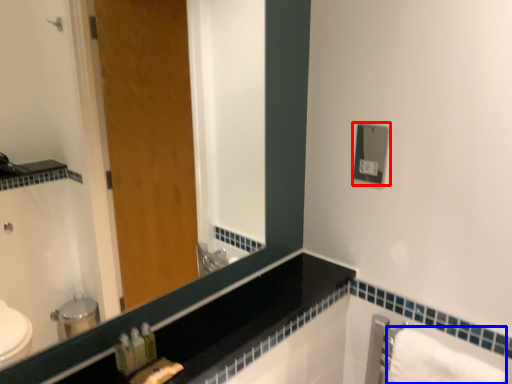
Question: Which of the following is the farthest to the observer, electric outlet (highlighted by a red box) or bath towel (highlighted by a blue box)?

Choices:
 (A) electric outlet
 (B) bath towel

Answer: (A)